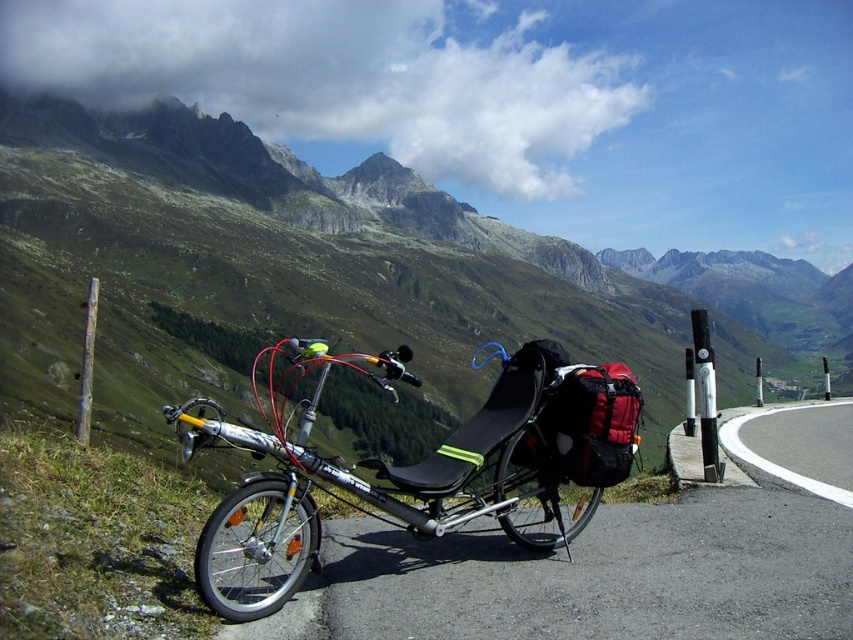
Does black matte bicycle at center appear under red fabric backpack at center?

Yes, black matte bicycle at center is below red fabric backpack at center.

Between black matte bicycle at center and red fabric backpack at center, which one is positioned higher?

red fabric backpack at center

Identify the location of black matte bicycle at center. The width and height of the screenshot is (853, 640). (419, 474).

Does black matte bicycle at center appear on the left side of wooden post at left?

No, black matte bicycle at center is not to the left of wooden post at left.

Does black matte bicycle at center have a greater height compared to wooden post at left?

Indeed, black matte bicycle at center has a greater height compared to wooden post at left.

Is point (231, 548) behind point (90, 355)?

No, it is in front of (90, 355).

You are a GUI agent. You are given a task and a screenshot of the screen. Output one action in this format:
    pyautogui.click(x=<x>, y=<y>)
    Task: Click on the black matte bicycle at center
    
    Given the screenshot: What is the action you would take?
    pyautogui.click(x=419, y=474)

Between point (248, 182) and point (560, 404), which one is positioned behind?

Point (248, 182)

Is point (28, 109) behind point (547, 410)?

Yes.

Locate an element on the screen. The height and width of the screenshot is (640, 853). rugged granite mountain at upper center is located at coordinates (375, 248).